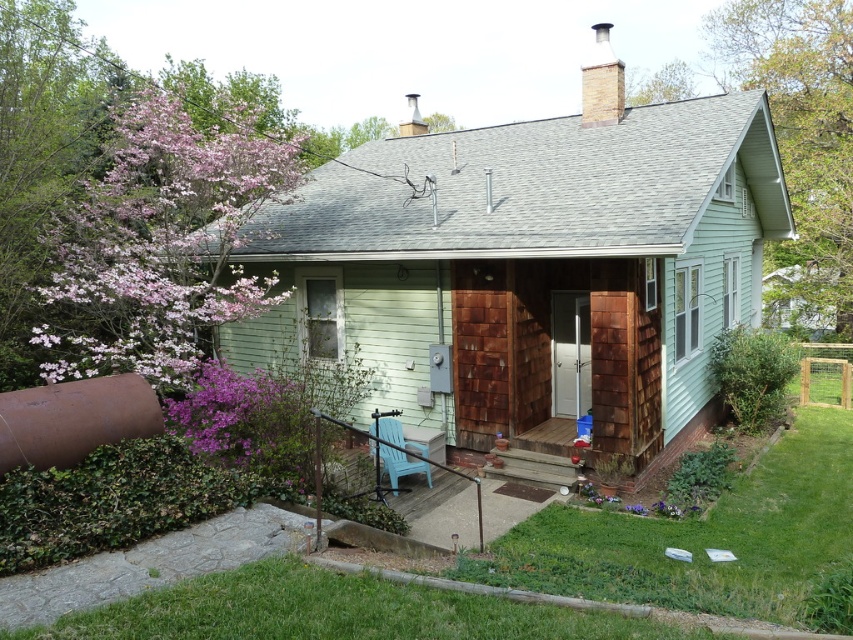
Question: Which point appears closest to the camera in this image?

Choices:
 (A) (521, 465)
 (B) (602, 90)

Answer: (A)

Question: Which of these objects is positioned farthest from the light green siding at center?

Choices:
 (A) purple matte flower at lower left
 (B) rustic wood porch at lower center
 (C) pink bloom at upper left

Answer: (C)

Question: Can you confirm if light green siding at center is thinner than rustic wood porch at lower center?

Choices:
 (A) yes
 (B) no

Answer: (B)

Question: Considering the real-world distances, which object is farthest from the pink bloom at upper left?

Choices:
 (A) rustic wood porch at lower center
 (B) purple matte flower at lower left

Answer: (A)

Question: Does pink bloom at upper left lie in front of purple matte flower at lower left?

Choices:
 (A) no
 (B) yes

Answer: (A)

Question: Is light green siding at center positioned in front of purple matte flower at lower left?

Choices:
 (A) no
 (B) yes

Answer: (A)